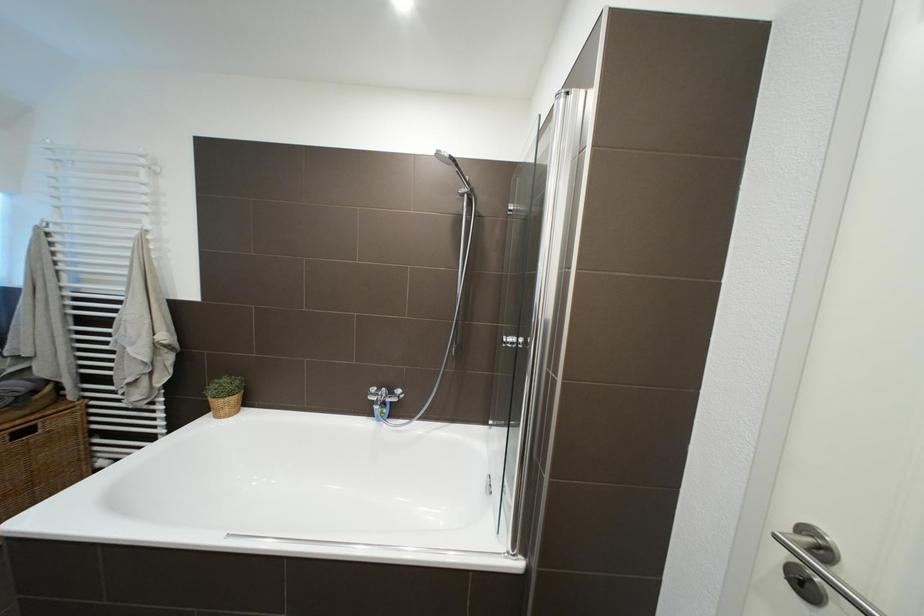
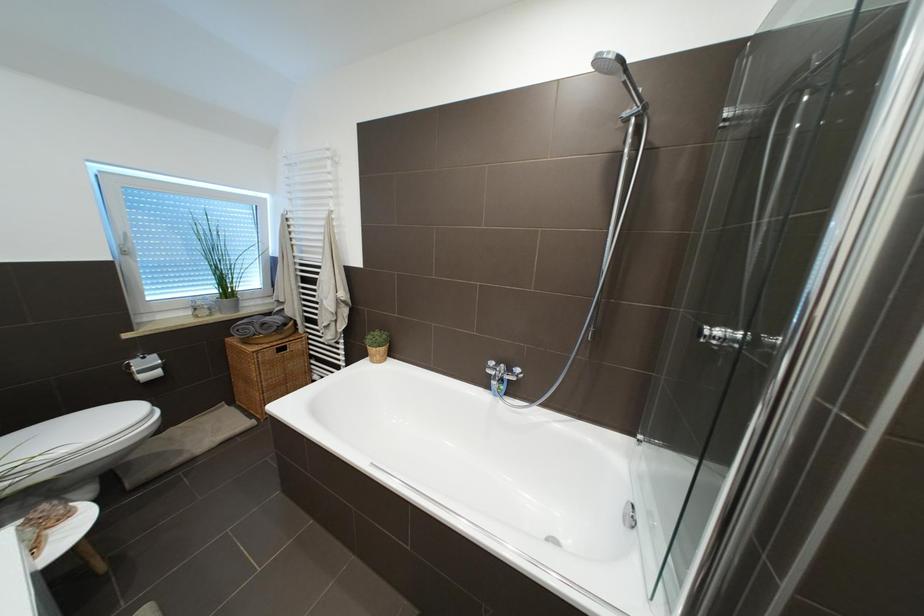
Question: How did the camera likely rotate?

Choices:
 (A) Left
 (B) Right
 (C) Up
 (D) Down

Answer: (A)